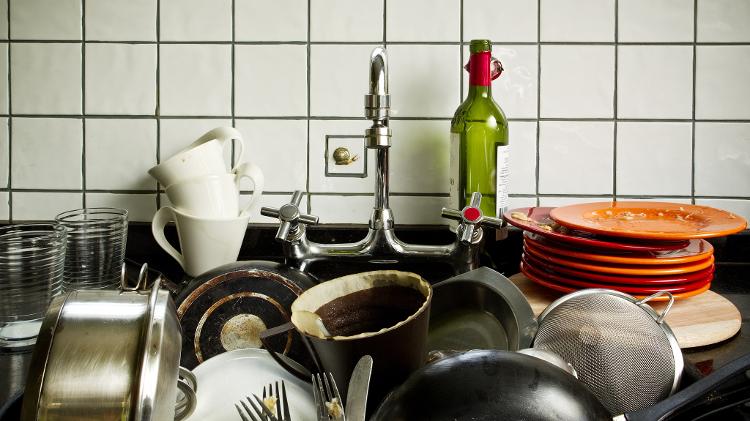
The width and height of the screenshot is (750, 421). Find the location of `cups`. cups is located at coordinates (21, 283), (84, 253), (201, 232), (212, 195), (195, 158).